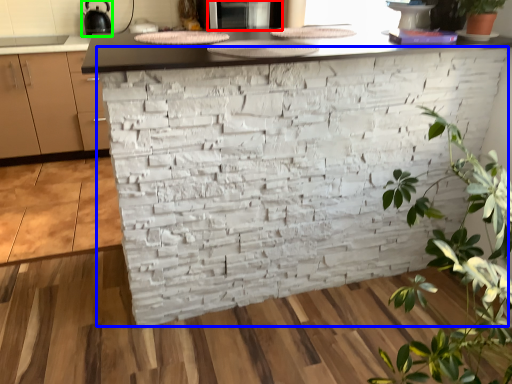
Question: Which object is the farthest from appliance (highlighted by a red box)? Choose among these: brickwork (highlighted by a blue box) or appliance (highlighted by a green box).

Choices:
 (A) brickwork
 (B) appliance

Answer: (B)